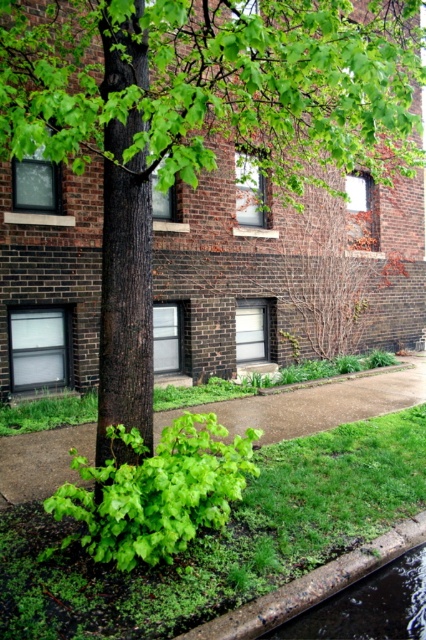
Does green leafy grass at lower center have a lesser width compared to green grass at lower center?

Incorrect, green leafy grass at lower center's width is not less than green grass at lower center's.

Does green leafy grass at lower center appear on the right side of green grass at lower center?

No, green leafy grass at lower center is not to the right of green grass at lower center.

Locate an element on the screen. Image resolution: width=426 pixels, height=640 pixels. green leafy grass at lower center is located at coordinates (221, 540).